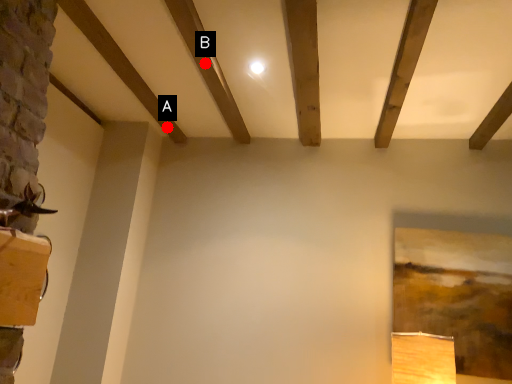
Question: Two points are circled on the image, labeled by A and B beside each circle. Which point is farther to the camera?

Choices:
 (A) A is further
 (B) B is further

Answer: (A)